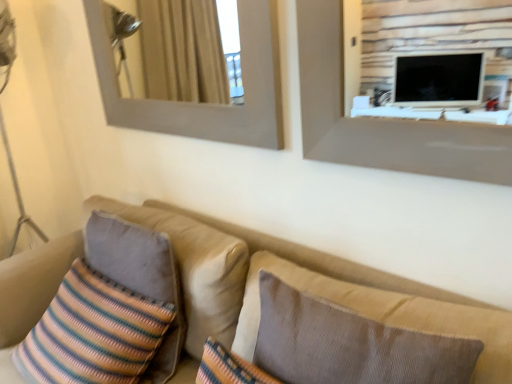
Question: Considering the positions of point (420, 339) and point (111, 235), is point (420, 339) closer or farther from the camera than point (111, 235)?

Choices:
 (A) farther
 (B) closer

Answer: (B)

Question: Looking at the image, does brown textured pillow at center, which appears as the second pillow when viewed from the back, seem bigger or smaller compared to striped fabric pillow at left, placed as the second pillow when sorted from right to left?

Choices:
 (A) big
 (B) small

Answer: (A)

Question: Considering the real-world distances, which object is farthest from the wooden frame at upper left?

Choices:
 (A) striped fabric pillow at left, which is the 1th pillow in left-to-right order
 (B) brown textured pillow at center, which appears as the second pillow when viewed from the back
 (C) beige fabric couch at lower left
 (D) striped fabric pillow at lower left

Answer: (D)

Question: Estimate the real-world distances between objects in this image. Which object is farther from the striped fabric pillow at lower left?

Choices:
 (A) wooden frame at upper left
 (B) brown textured pillow at center, which is counted as the 1th pillow, starting from the right
 (C) striped fabric pillow at left, which is the 1th pillow in left-to-right order
 (D) beige fabric couch at lower left

Answer: (A)